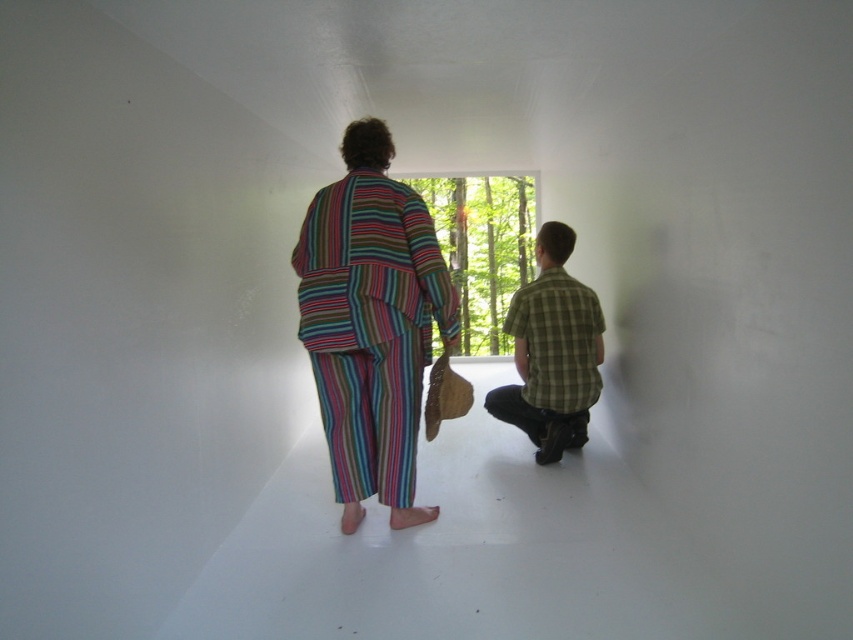
You are standing in the room and want to hand a small item to the person wearing the green plaid shirt at center without disturbing the person in the multicolored striped robe at center. Which person should you approach first?

You should approach the multicolored striped robe at center first because it is closer to you than the green plaid shirt at center, so you can reach them without disturbing the other person.

You are a photographer trying to capture both the multicolored striped robe at center and the green plaid shirt at center in a single frame. Based on their sizes, which one should you focus on to ensure both are clearly visible?

The multicolored striped robe at center is smaller than the green plaid shirt at center. To ensure both are clearly visible, focus on the green plaid shirt at center since it is larger and will be easier to capture in detail while still fitting the smaller robe into the frame.